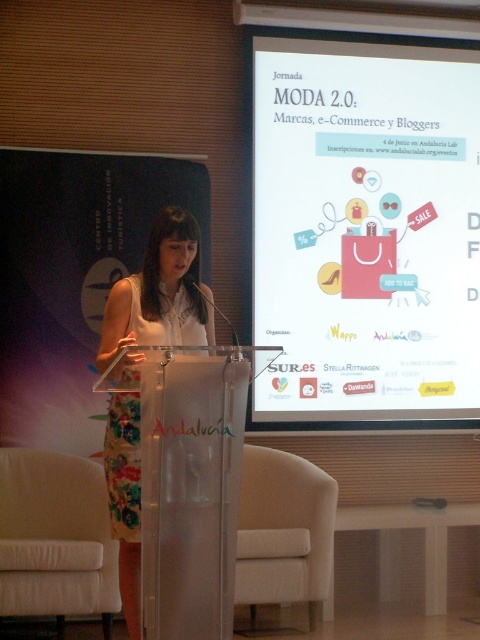
Question: Is white paper at upper center bigger than floral fabric dress at center?

Choices:
 (A) no
 (B) yes

Answer: (B)

Question: Can you confirm if white paper at upper center is positioned above floral fabric dress at center?

Choices:
 (A) yes
 (B) no

Answer: (A)

Question: Does white paper at upper center lie in front of floral fabric dress at center?

Choices:
 (A) yes
 (B) no

Answer: (B)

Question: Among these points, which one is nearest to the camera?

Choices:
 (A) (434, 250)
 (B) (197, 344)

Answer: (B)